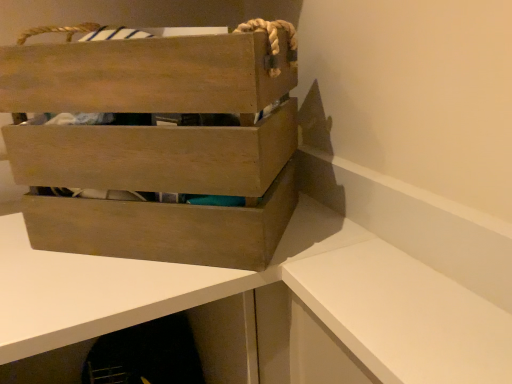
Find the location of `wooden crate at upper left`. wooden crate at upper left is located at coordinates (159, 144).

Describe the element at coordinates (159, 144) in the screenshot. I see `wooden crate at upper left` at that location.

Locate an element on the screen. The image size is (512, 384). wooden crate at upper left is located at coordinates click(110, 298).

What do you see at coordinates (110, 298) in the screenshot?
I see `wooden crate at upper left` at bounding box center [110, 298].

The width and height of the screenshot is (512, 384). I want to click on wooden crate at upper left, so click(x=159, y=144).

Would you say wooden crate at upper left is to the left or to the right of wooden crate at upper left in the picture?

Based on their positions, wooden crate at upper left is located to the right of wooden crate at upper left.

Is the depth of wooden crate at upper left less than that of wooden crate at upper left?

No, the depth of wooden crate at upper left is greater than that of wooden crate at upper left.

Which point is more distant from viewer, (192, 61) or (92, 273)?

The point (92, 273) is behind.

From the picture: From the image's perspective, between wooden crate at upper left and wooden crate at upper left, who is located below?

wooden crate at upper left.

From a real-world perspective, between wooden crate at upper left and wooden crate at upper left, who is vertically lower?

In real-world perspective, wooden crate at upper left is lower.

Considering the sizes of objects wooden crate at upper left and wooden crate at upper left in the image provided, who is wider, wooden crate at upper left or wooden crate at upper left?

wooden crate at upper left is wider.

Considering the relative sizes of wooden crate at upper left and wooden crate at upper left in the image provided, is wooden crate at upper left taller than wooden crate at upper left?

No, wooden crate at upper left is not taller than wooden crate at upper left.

Which of these two, wooden crate at upper left or wooden crate at upper left, is bigger?

Bigger between the two is wooden crate at upper left.

Is wooden crate at upper left inside or outside of wooden crate at upper left?

wooden crate at upper left is spatially situated outside wooden crate at upper left.

Is wooden crate at upper left not close to wooden crate at upper left?

That's not correct — wooden crate at upper left is a little close to wooden crate at upper left.

Could you tell me if wooden crate at upper left is turned towards wooden crate at upper left?

No, wooden crate at upper left is not oriented towards wooden crate at upper left.

How different are the orientations of wooden crate at upper left and wooden crate at upper left in degrees?

They differ by 40.6 degrees in their facing directions.

The height and width of the screenshot is (384, 512). Identify the location of box behind the wooden crate at upper left. (159, 144).

Can you confirm if wooden crate at upper left is positioned to the right of wooden crate at upper left?

Incorrect, wooden crate at upper left is not on the right side of wooden crate at upper left.

In the scene shown: In the image, is wooden crate at upper left positioned in front of or behind wooden crate at upper left?

wooden crate at upper left is positioned closer to the viewer than wooden crate at upper left.

Is point (68, 340) closer to viewer compared to point (169, 88)?

Yes, point (68, 340) is in front of point (169, 88).

From the image's perspective, is wooden crate at upper left located beneath wooden crate at upper left?

Yes, from the image's perspective, wooden crate at upper left is below wooden crate at upper left.

From a real-world perspective, between wooden crate at upper left and wooden crate at upper left, who is vertically lower?

In real-world perspective, wooden crate at upper left is lower.

Considering the sizes of objects wooden crate at upper left and wooden crate at upper left in the image provided, who is wider, wooden crate at upper left or wooden crate at upper left?

wooden crate at upper left.

Can you confirm if wooden crate at upper left is shorter than wooden crate at upper left?

No.

Considering the sizes of objects wooden crate at upper left and wooden crate at upper left in the image provided, who is smaller, wooden crate at upper left or wooden crate at upper left?

wooden crate at upper left is smaller.

Do you think wooden crate at upper left is within wooden crate at upper left, or outside of it?

wooden crate at upper left is outside wooden crate at upper left.

Is wooden crate at upper left not close to wooden crate at upper left?

They are positioned close to each other.

Does wooden crate at upper left turn towards wooden crate at upper left?

No, wooden crate at upper left does not turn towards wooden crate at upper left.

How many degrees apart are the facing directions of wooden crate at upper left and wooden crate at upper left?

The angle between the facing direction of wooden crate at upper left and the facing direction of wooden crate at upper left is 40.6 degrees.

In order to click on table in front of the wooden crate at upper left in this screenshot , I will do `click(110, 298)`.

Where is `box to the right of wooden crate at upper left`? The width and height of the screenshot is (512, 384). box to the right of wooden crate at upper left is located at coordinates (159, 144).

At what (x,y) coordinates should I click in order to perform the action: click on table that is below the wooden crate at upper left (from the image's perspective). Please return your answer as a coordinate pair (x, y). This screenshot has height=384, width=512. Looking at the image, I should click on (110, 298).